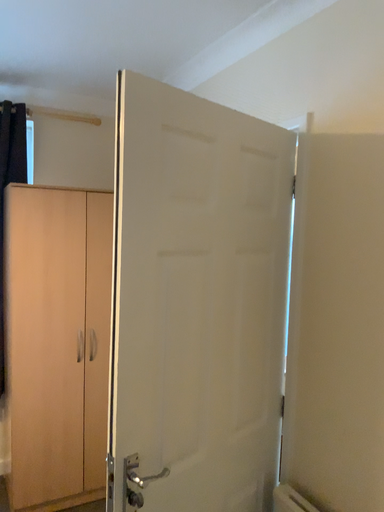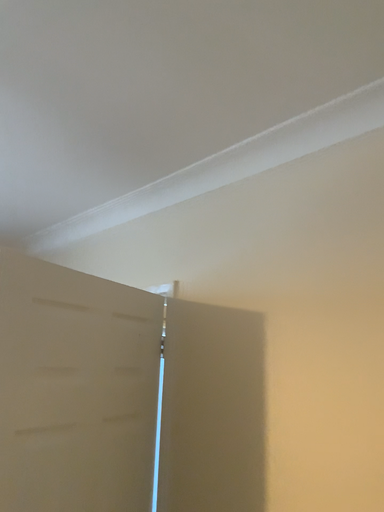
Question: How did the camera likely rotate when shooting the video?

Choices:
 (A) rotated right
 (B) rotated left

Answer: (A)